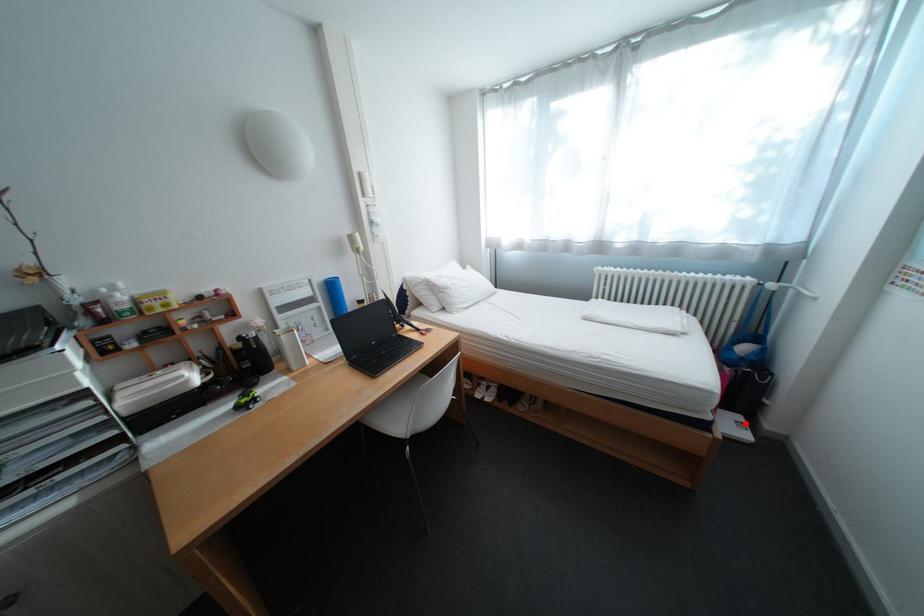
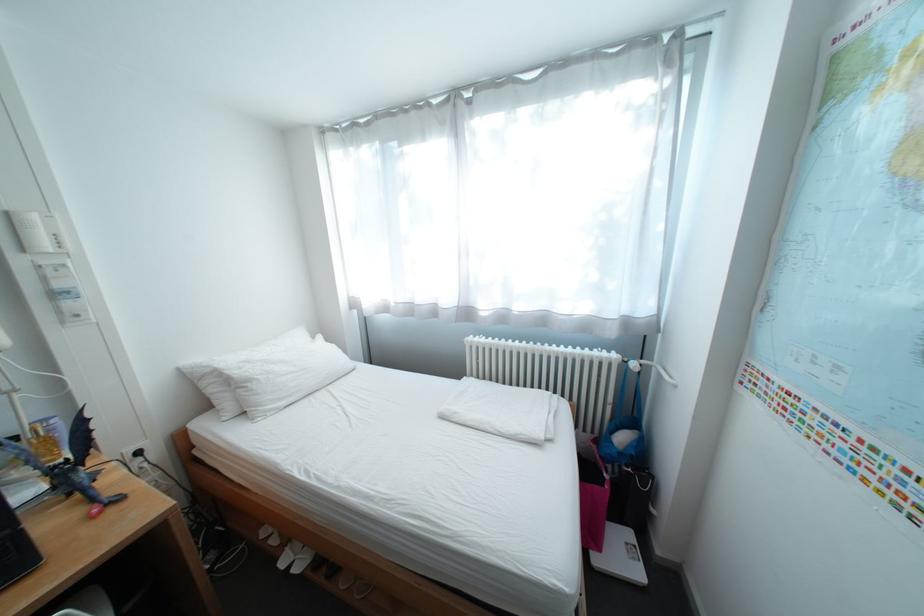
In the second image, find the point that corresponds to the highlighted location in the first image.

(637, 548)